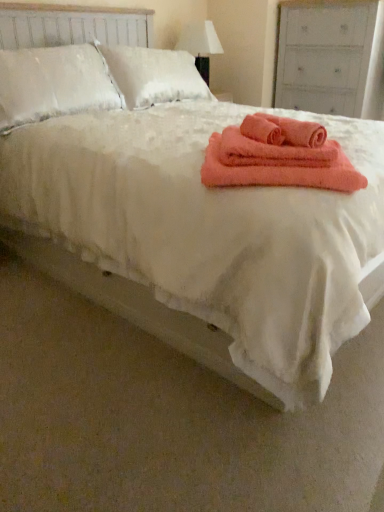
Identify the location of free space on the front side of coral soft towel at center, positioned as the 3th bath towel in right-to-left order. (276, 155).